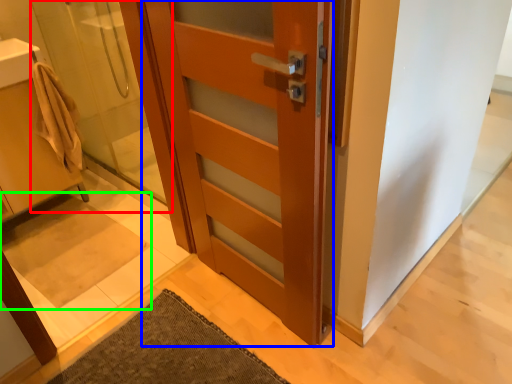
Question: Based on their relative distances, which object is nearer to shower door (highlighted by a red box)? Choose from door (highlighted by a blue box) and bath mat (highlighted by a green box).

Choices:
 (A) door
 (B) bath mat

Answer: (B)